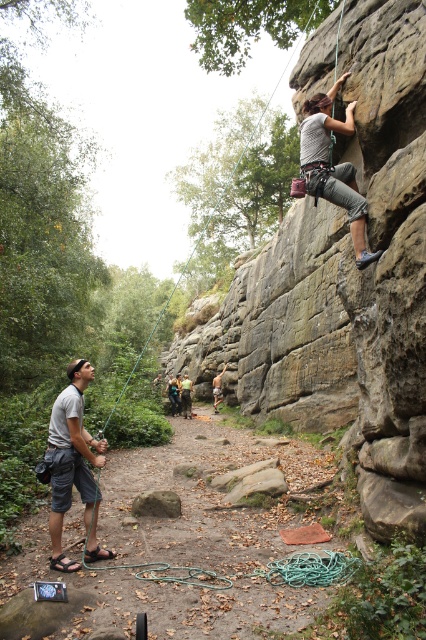
You are a photographer trying to capture the climber and the person on the ground in a single shot. Given the camera lens you have can only focus on objects within a 1.5 meter width range, can you fit both the gray fabric shirt at left and the brown rough rock at center into the frame without adjusting your position?

The gray fabric shirt at left might be wider than brown rough rock at center, so it is possible to fit both into the frame if their combined width falls within the 1.5 meter range. However, without exact measurements, it is uncertain if they will fit perfectly.

In the scene shown: You are a safety inspector assessing the climbing setup. The gray fabric shirt at left is the belayer, and the brown rough rock at center is the climbing wall. According to safety guidelines, the minimum safe distance between the belayer and the climbing wall should be 7 feet to allow for proper rope management. Is the current distance compliant with safety standards?

The gray fabric shirt at left and brown rough rock at center are 6.70 feet apart from each other. Since the required minimum distance is 7 feet, the current setup does not meet safety standards as it is 0.30 feet too short.